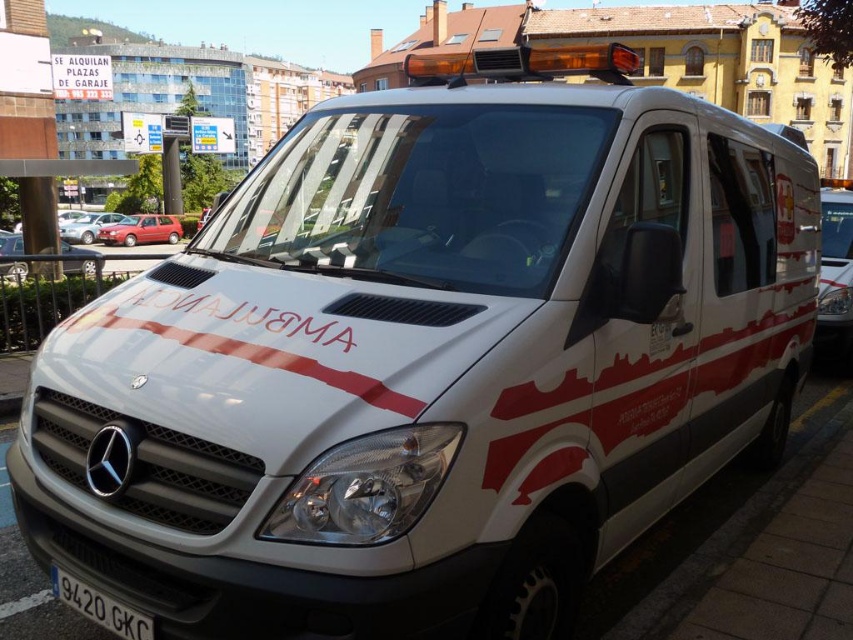
Who is positioned more to the left, metallic red hatchback at center-left or matte red car at left?

Positioned to the left is matte red car at left.

Who is more distant from viewer, [167,230] or [115,220]?

Positioned behind is point [115,220].

Image resolution: width=853 pixels, height=640 pixels. I want to click on metallic red hatchback at center-left, so click(x=141, y=230).

Does white plastic license plate at lower center appear under metallic silver sedan at center?

Correct, white plastic license plate at lower center is located below metallic silver sedan at center.

At what (x,y) coordinates should I click in order to perform the action: click on white plastic license plate at lower center. Please return your answer as a coordinate pair (x, y). Looking at the image, I should click on (100, 608).

Identify the location of white plastic license plate at lower center. Image resolution: width=853 pixels, height=640 pixels. (100, 608).

Locate an element on the screen. This screenshot has height=640, width=853. white plastic license plate at lower center is located at coordinates (100, 608).

Does white plastic license plate at lower center appear on the right side of metallic red hatchback at center-left?

Yes, white plastic license plate at lower center is to the right of metallic red hatchback at center-left.

What do you see at coordinates (100, 608) in the screenshot? The width and height of the screenshot is (853, 640). I see `white plastic license plate at lower center` at bounding box center [100, 608].

Locate an element on the screen. The height and width of the screenshot is (640, 853). white plastic license plate at lower center is located at coordinates (100, 608).